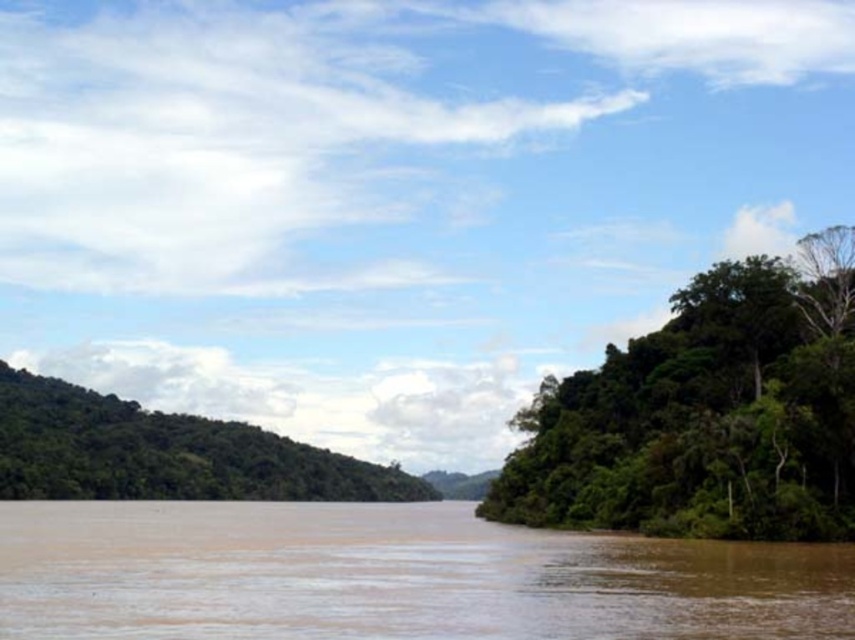
Question: Is brown muddy water at center thinner than green leafy trees at right?

Choices:
 (A) yes
 (B) no

Answer: (B)

Question: Estimate the real-world distances between objects in this image. Which object is farther from the green leafy trees at right?

Choices:
 (A) brown muddy water at center
 (B) green leafy forest at left

Answer: (B)

Question: Which object appears farthest from the camera in this image?

Choices:
 (A) green leafy forest at left
 (B) brown muddy water at center
 (C) green leafy trees at right

Answer: (A)

Question: Can you confirm if green leafy trees at right is positioned below green leafy forest at left?

Choices:
 (A) no
 (B) yes

Answer: (A)

Question: Does green leafy trees at right come in front of green leafy forest at left?

Choices:
 (A) yes
 (B) no

Answer: (A)

Question: Which object is closer to the camera taking this photo?

Choices:
 (A) green leafy trees at right
 (B) green leafy forest at left

Answer: (A)